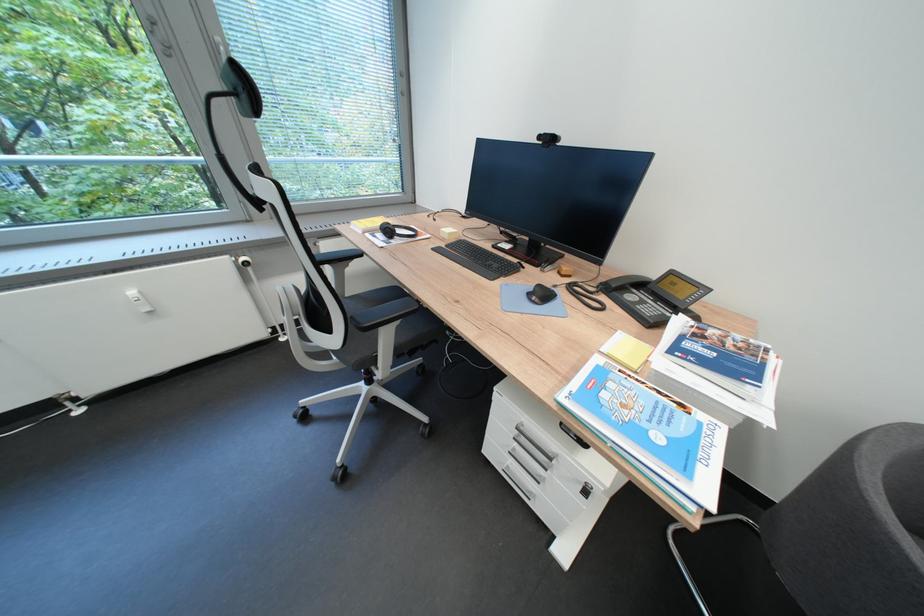
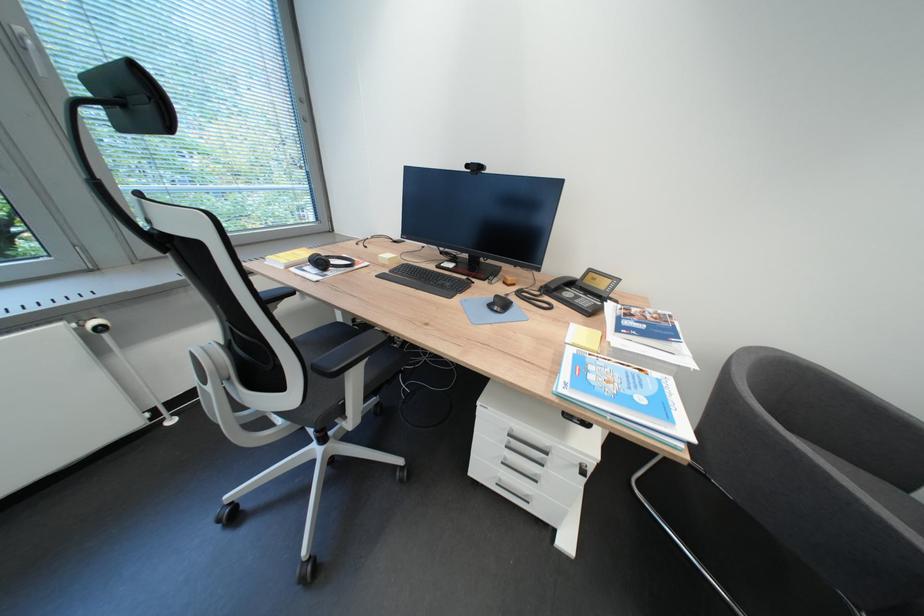
In the second image, find the point that corresponds to pixel 257 99 in the first image.

(160, 110)